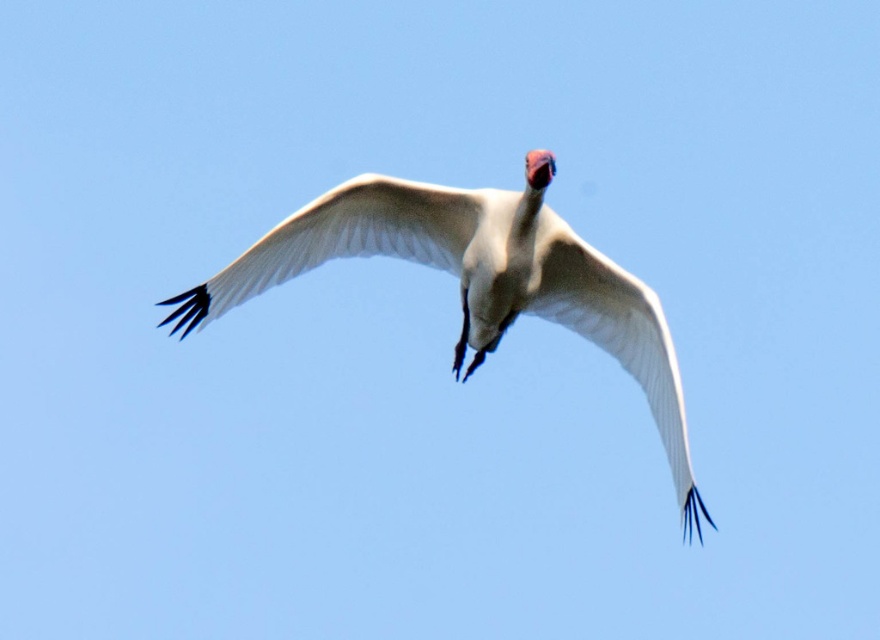
Which is more to the right, white feathered bird at center or white feathered wing at center?

Positioned to the right is white feathered bird at center.

Who is more distant from viewer, (548, 256) or (400, 253)?

The point (400, 253) is more distant.

Find the location of `white feathered bird at center`. white feathered bird at center is located at coordinates (477, 280).